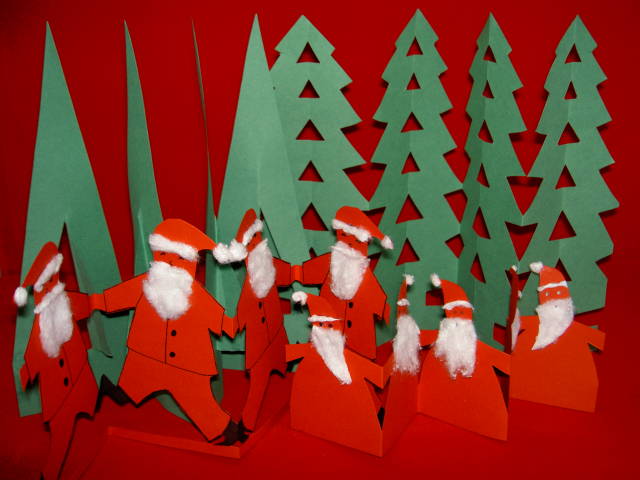
The image size is (640, 480). What are the coordinates of `background wall` in the screenshot? It's located at (219, 51).